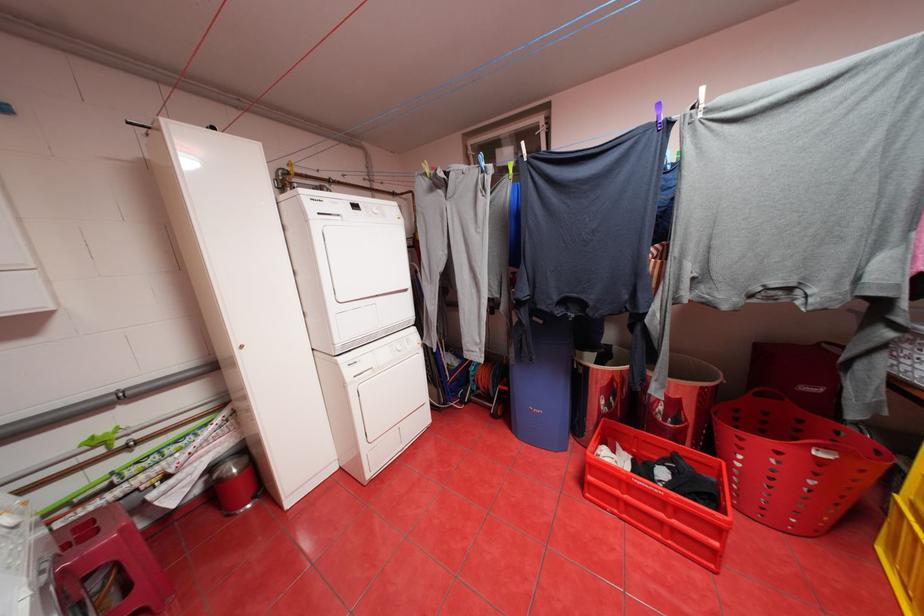
Find where to pinch the purple clothespin. Please return your answer as a coordinate pair (x, y).

(659, 114)